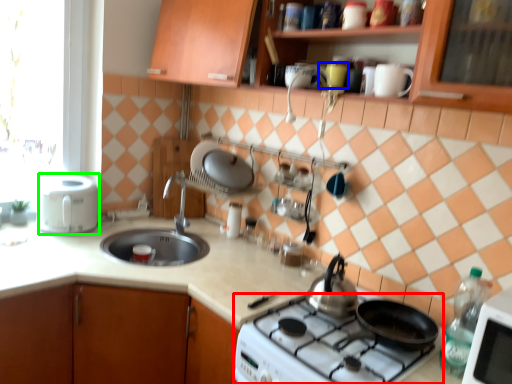
Question: Which object is the farthest from gas stove (highlighted by a red box)? Choose among these: mug (highlighted by a blue box) or kitchen appliance (highlighted by a green box).

Choices:
 (A) mug
 (B) kitchen appliance

Answer: (B)